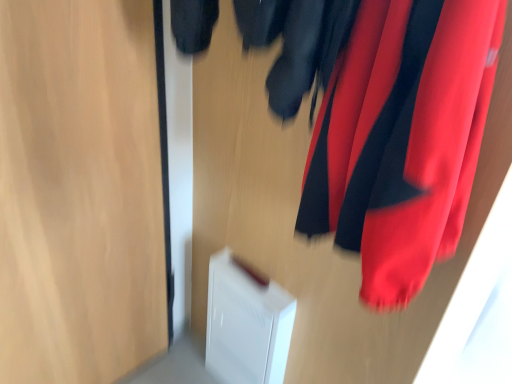
Question: From a real-world perspective, is transparent glass door at left positioned above or below satin red curtain at upper right?

Choices:
 (A) below
 (B) above

Answer: (A)

Question: Is point (114, 132) closer or farther from the camera than point (354, 241)?

Choices:
 (A) closer
 (B) farther

Answer: (B)

Question: Is transparent glass door at left bigger or smaller than satin red curtain at upper right?

Choices:
 (A) small
 (B) big

Answer: (B)

Question: Is satin red curtain at upper right taller or shorter than transparent glass door at left?

Choices:
 (A) short
 (B) tall

Answer: (A)

Question: Is point (470, 137) closer or farther from the camera than point (139, 59)?

Choices:
 (A) farther
 (B) closer

Answer: (B)

Question: In terms of width, does satin red curtain at upper right look wider or thinner when compared to transparent glass door at left?

Choices:
 (A) wide
 (B) thin

Answer: (A)

Question: From a real-world perspective, is satin red curtain at upper right above or below transparent glass door at left?

Choices:
 (A) below
 (B) above

Answer: (B)